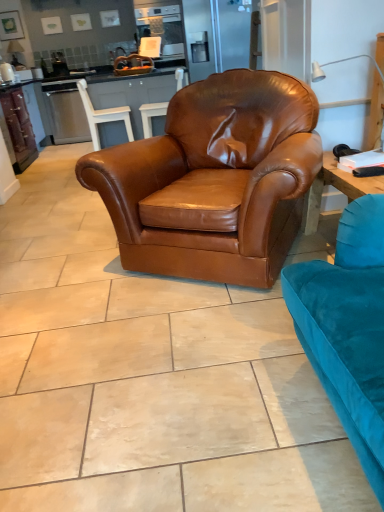
Question: From the image's perspective, is brown leather armchair at center, the 2th chair viewed from the front, on satin silver oven at upper center?

Choices:
 (A) no
 (B) yes

Answer: (A)

Question: Is brown leather armchair at center, which is the 2th chair in back-to-front order, looking in the opposite direction of satin silver oven at upper center?

Choices:
 (A) no
 (B) yes

Answer: (A)

Question: Is there a large distance between brown leather armchair at center, which is the 2th chair in back-to-front order, and satin silver oven at upper center?

Choices:
 (A) no
 (B) yes

Answer: (B)

Question: Is brown leather armchair at center, the 2th chair viewed from the front, beside satin silver oven at upper center?

Choices:
 (A) no
 (B) yes

Answer: (A)

Question: From the image's perspective, would you say brown leather armchair at center, which is the 2th chair in back-to-front order, is shown under satin silver oven at upper center?

Choices:
 (A) yes
 (B) no

Answer: (A)

Question: Is brown leather armchair at center, which is the 2th chair in back-to-front order, thinner than satin silver oven at upper center?

Choices:
 (A) no
 (B) yes

Answer: (B)

Question: Considering the relative sizes of brown leather armchair at center, which is counted as the 3th chair, starting from the front, and brown leather armchair at center, the 2th chair viewed from the front, in the image provided, is brown leather armchair at center, which is counted as the 3th chair, starting from the front, wider than brown leather armchair at center, the 2th chair viewed from the front,?

Choices:
 (A) no
 (B) yes

Answer: (B)

Question: From a real-world perspective, is brown leather armchair at center, which is counted as the 3th chair, starting from the front, over brown leather armchair at center, the 2th chair viewed from the front?

Choices:
 (A) no
 (B) yes

Answer: (B)

Question: Is brown leather armchair at center, which is the 2th chair in back-to-front order, inside brown leather armchair at center, which is counted as the 3th chair, starting from the front?

Choices:
 (A) yes
 (B) no

Answer: (B)

Question: Considering the relative sizes of brown leather armchair at center, which is counted as the 1th chair, starting from the back, and brown leather armchair at center, the 2th chair viewed from the front, in the image provided, is brown leather armchair at center, which is counted as the 1th chair, starting from the back, smaller than brown leather armchair at center, the 2th chair viewed from the front,?

Choices:
 (A) yes
 (B) no

Answer: (A)

Question: From the image's perspective, is brown leather armchair at center, which is counted as the 3th chair, starting from the front, above brown leather armchair at center, the 2th chair viewed from the front?

Choices:
 (A) yes
 (B) no

Answer: (A)

Question: From the image's perspective, is brown leather armchair at center, which is counted as the 1th chair, starting from the back, under brown leather armchair at center, which is the 2th chair in back-to-front order?

Choices:
 (A) yes
 (B) no

Answer: (B)

Question: From the image's perspective, is satin silver oven at upper center under brown leather armchair at center, which ranks as the 1th chair in front-to-back order?

Choices:
 (A) no
 (B) yes

Answer: (A)